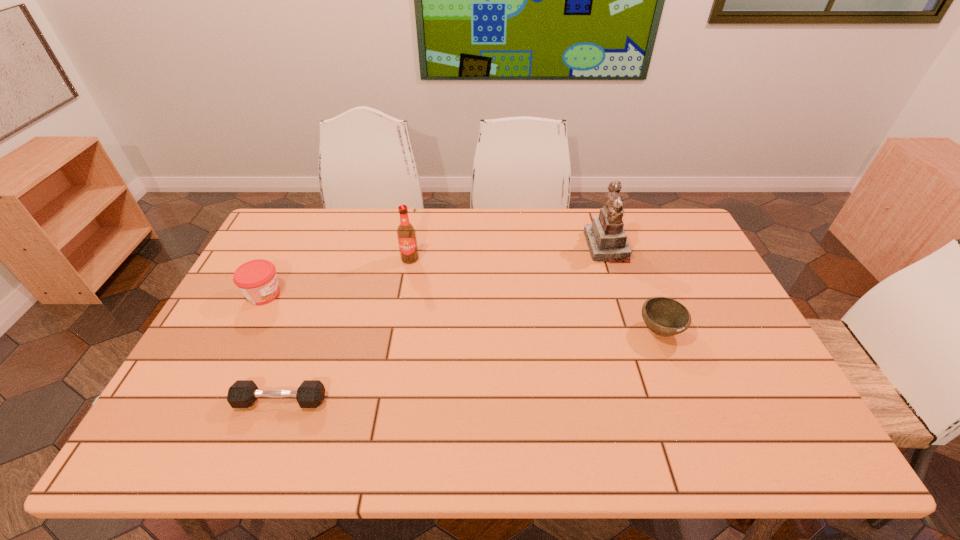
Where is `free space that satisfies the following two spatial constraints: 1. on the back side of the fourth farthest object; 2. on the label side of the third tallest object`? The width and height of the screenshot is (960, 540). free space that satisfies the following two spatial constraints: 1. on the back side of the fourth farthest object; 2. on the label side of the third tallest object is located at coordinates (646, 294).

Where is `vacant space that satisfies the following two spatial constraints: 1. on the back side of the shortest object; 2. on the right side of the beer bottle`? vacant space that satisfies the following two spatial constraints: 1. on the back side of the shortest object; 2. on the right side of the beer bottle is located at coordinates pyautogui.click(x=333, y=259).

I want to click on free location that satisfies the following two spatial constraints: 1. on the front-facing side of the figurine; 2. on the back side of the fourth farthest object, so click(x=635, y=330).

Where is `free point that satisfies the following two spatial constraints: 1. on the front-facing side of the figurine; 2. on the right side of the bowl`? The width and height of the screenshot is (960, 540). free point that satisfies the following two spatial constraints: 1. on the front-facing side of the figurine; 2. on the right side of the bowl is located at coordinates (635, 330).

The image size is (960, 540). I want to click on free location that satisfies the following two spatial constraints: 1. on the label side of the third shortest object; 2. on the right side of the fourth object from right to left, so click(x=210, y=401).

Locate an element on the screen. Image resolution: width=960 pixels, height=540 pixels. vacant space that satisfies the following two spatial constraints: 1. on the front-facing side of the bowl; 2. on the left side of the figurine is located at coordinates [x=635, y=330].